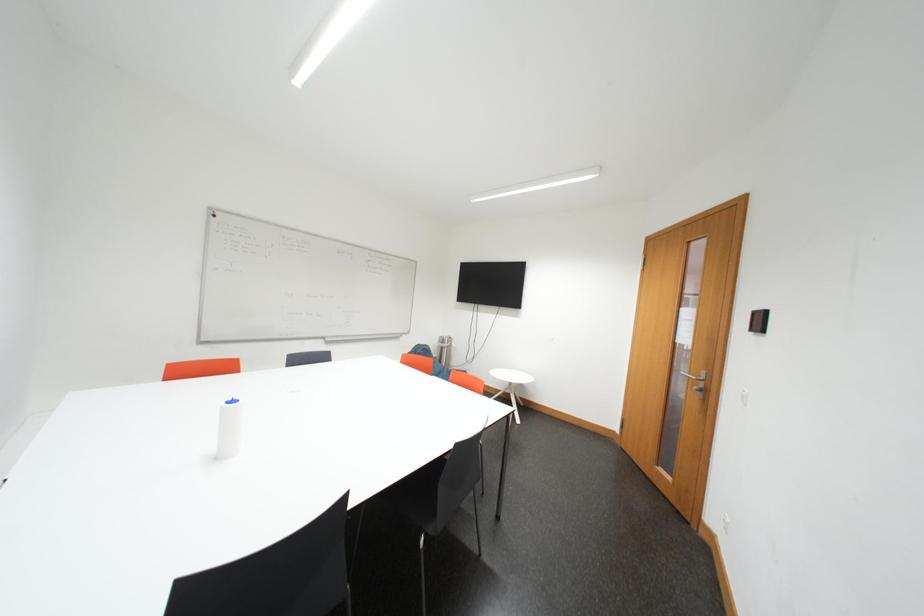
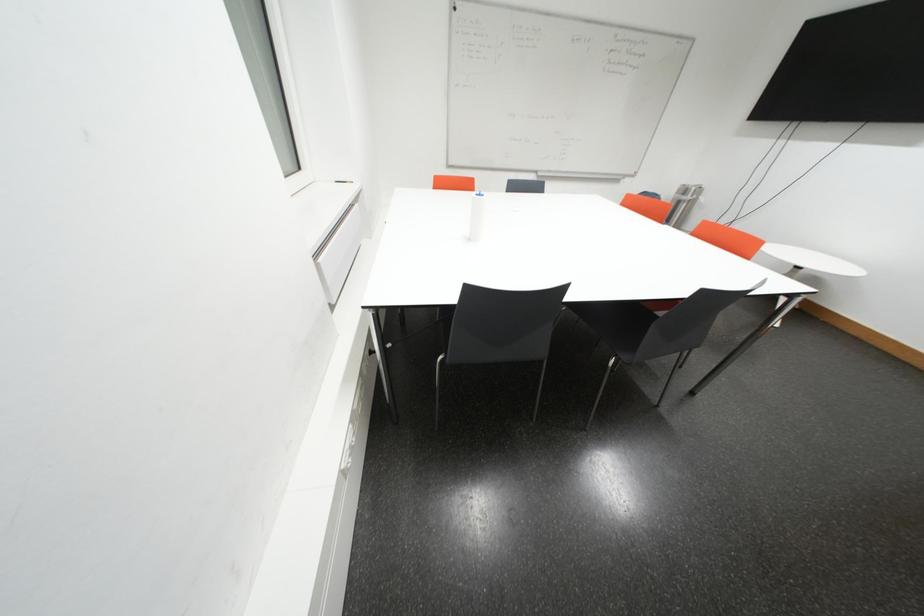
Based on the continuous images, in which direction is the camera rotating?

The rotation direction of the camera is left-down.